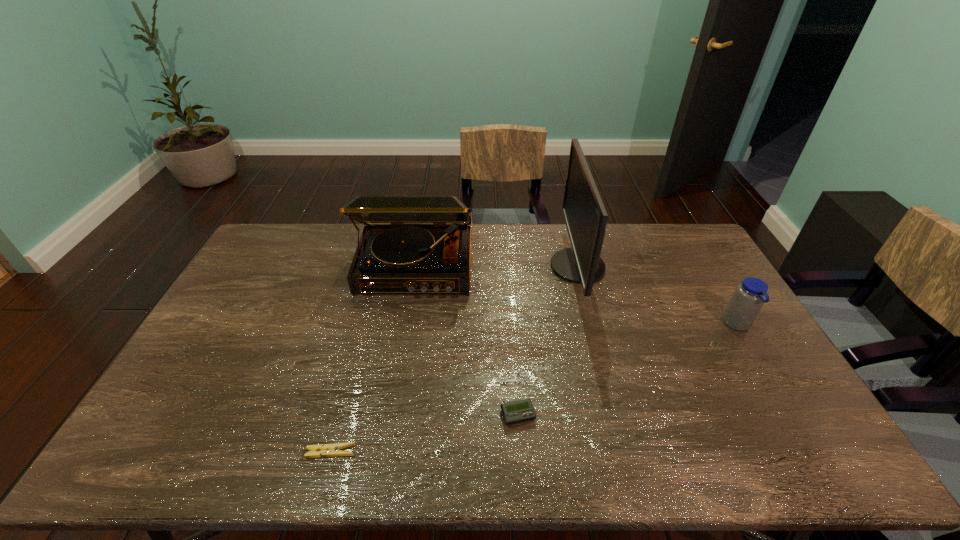
The width and height of the screenshot is (960, 540). What are the coordinates of `free region located on the screen side of the monitor` in the screenshot? It's located at (464, 266).

What are the coordinates of `free space located 0.120m on the screen side of the monitor` in the screenshot? It's located at (517, 266).

Where is `blank space located 0.300m on the front-facing side of the record player`? Image resolution: width=960 pixels, height=540 pixels. blank space located 0.300m on the front-facing side of the record player is located at coordinates (397, 374).

Locate an element on the screen. vacant space situated 0.310m with a carrying loop on the side of the third shortest object is located at coordinates (624, 325).

Image resolution: width=960 pixels, height=540 pixels. Find the location of `vacant region located with a carrying loop on the side of the third shortest object`. vacant region located with a carrying loop on the side of the third shortest object is located at coordinates (614, 325).

The height and width of the screenshot is (540, 960). I want to click on vacant space located with a carrying loop on the side of the third shortest object, so click(x=643, y=325).

Where is `vacant region located 0.230m on the left of the third object from left to right`? vacant region located 0.230m on the left of the third object from left to right is located at coordinates (411, 415).

You are a GUI agent. You are given a task and a screenshot of the screen. Output one action in this format:
    pyautogui.click(x=<x>, y=<y>)
    Task: Click on the vacant space located on the right of the nearest object
    The height and width of the screenshot is (540, 960).
    Given the screenshot: What is the action you would take?
    pyautogui.click(x=375, y=452)

Where is `monitor at the far edge`? This screenshot has width=960, height=540. monitor at the far edge is located at coordinates (585, 216).

The image size is (960, 540). I want to click on record player that is at the far edge, so click(410, 244).